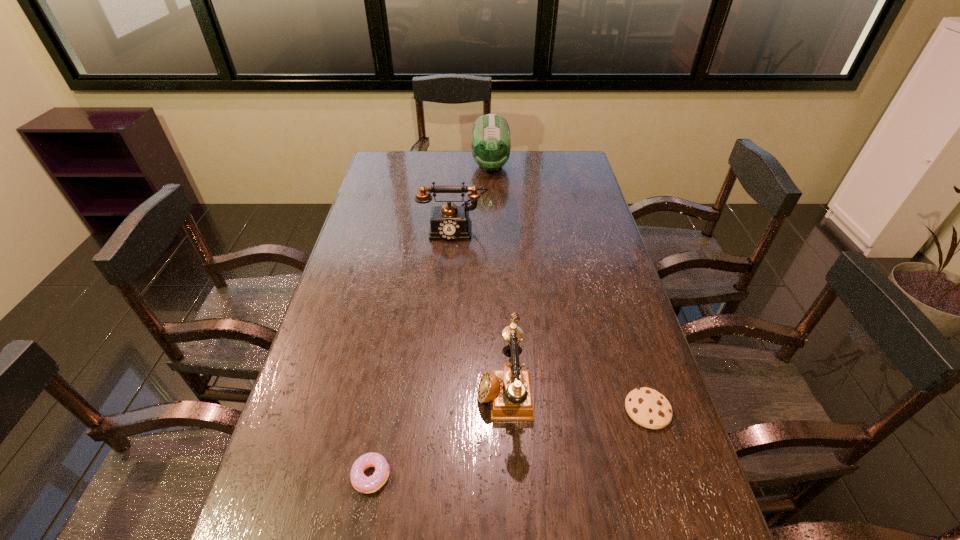
The width and height of the screenshot is (960, 540). In order to click on the farthest object in this screenshot , I will do `click(491, 140)`.

Find the location of a particular element. Image resolution: width=960 pixels, height=540 pixels. the fourth nearest object is located at coordinates [x=448, y=222].

This screenshot has width=960, height=540. I want to click on the nearer telephone, so click(509, 391).

In order to click on cookie in this screenshot , I will do `click(648, 408)`.

The image size is (960, 540). Identify the location of doughnut. (362, 483).

Where is `vacant point located 0.050m on the visor of the football helmet`? The image size is (960, 540). vacant point located 0.050m on the visor of the football helmet is located at coordinates (492, 186).

The width and height of the screenshot is (960, 540). I want to click on free spot located on the front of the farther telephone at the rotary dial, so click(449, 275).

The image size is (960, 540). Find the location of `vacant region located on the dial number of the nearer telephone`. vacant region located on the dial number of the nearer telephone is located at coordinates (332, 387).

I want to click on vacant space located on the dial number of the nearer telephone, so click(332, 387).

This screenshot has height=540, width=960. Find the location of `vacant point located 0.360m on the dial number of the nearer telephone`. vacant point located 0.360m on the dial number of the nearer telephone is located at coordinates (332, 387).